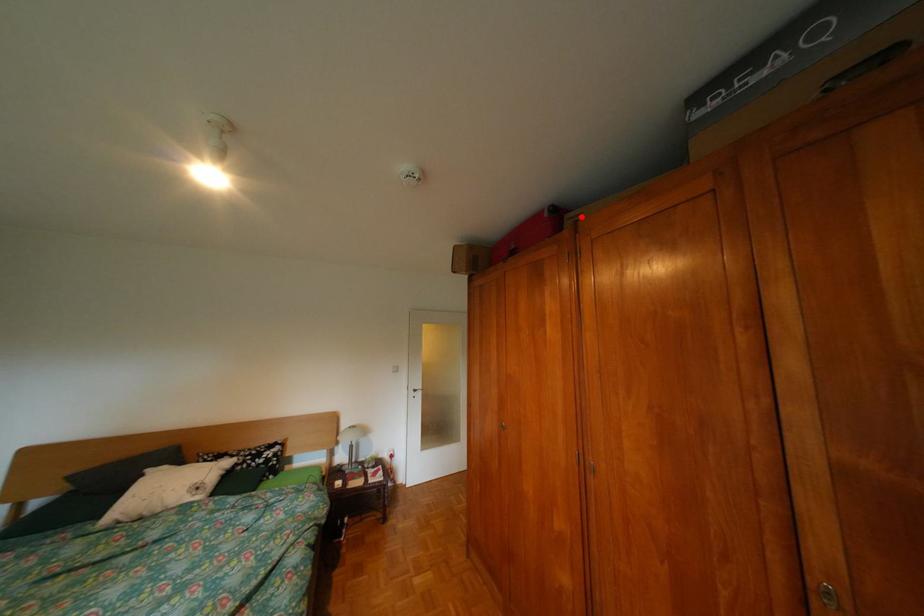
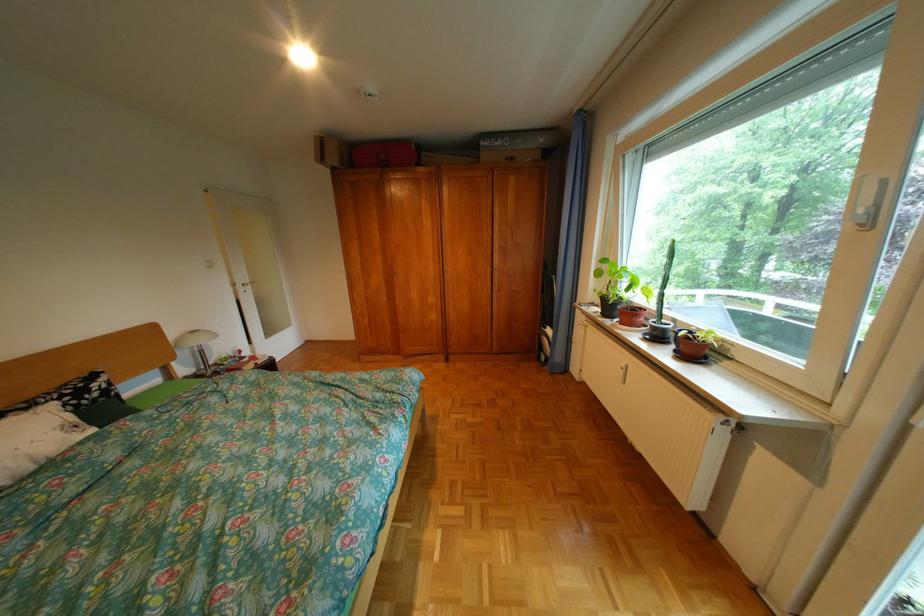
The point at the highlighted location is marked in the first image. Where is the corresponding point in the second image?

(438, 154)